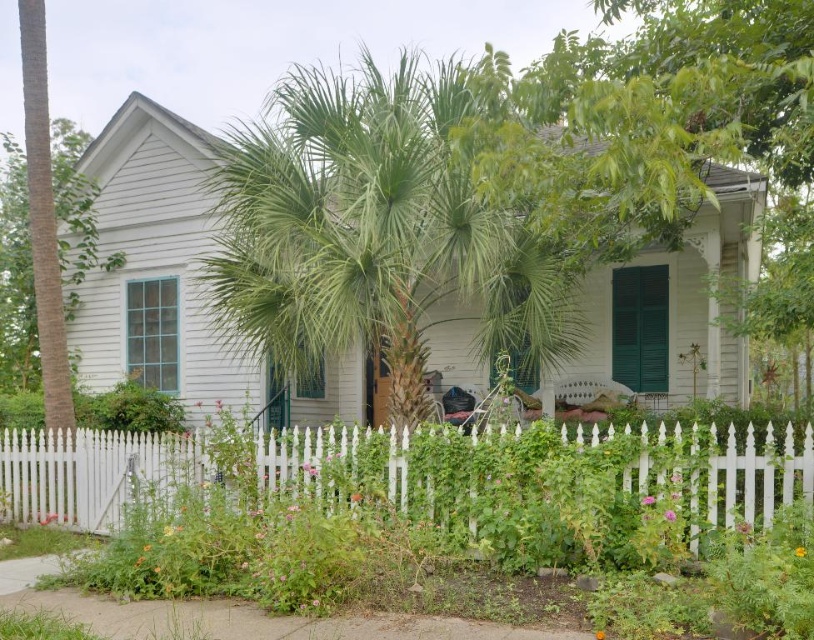
You are standing at the entrance of the small white house and want to walk to a specific location marked by point [659,269]. However, there is an obstruction at point [174,317]. According to the image, which point is closer to you, the obstruction or your destination?

Point [659,269] is in front of point [174,317], so the destination is closer to you than the obstruction.

You are a visitor approaching this house and want to enter through the front door. You see the white picket fence at lower center and the green matte shutters at lower right. Which object is closer to the front door?

The white picket fence at lower center is closer to the front door because it is smaller in size compared to the green matte shutters at lower right, indicating it is nearer to the observer.

You are a delivery person approaching the white house and need to reach the green matte window at center to drop off a package. The white picket fence at lower center is in your way. Can you walk around the fence to reach the window?

The white picket fence at lower center is 26.85 feet away from the green matte window at center. Since the fence is not directly blocking the path to the window, you can walk around it to reach the green matte window at center.